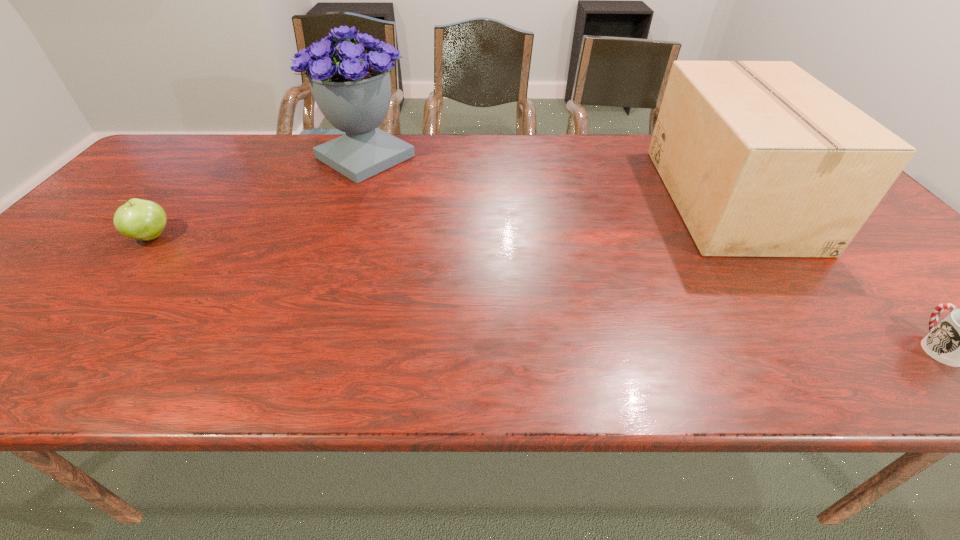
Identify the location of object that is at the left edge. Image resolution: width=960 pixels, height=540 pixels. (138, 219).

Where is `object that is at the right edge`? This screenshot has height=540, width=960. object that is at the right edge is located at coordinates (761, 159).

The image size is (960, 540). Find the location of `object positioned at the far right corner`. object positioned at the far right corner is located at coordinates (761, 159).

At what (x,y) coordinates should I click in order to perform the action: click on vacant space at the far edge. Please return your answer as a coordinate pair (x, y). Looking at the image, I should click on (608, 171).

Locate an element on the screen. Image resolution: width=960 pixels, height=540 pixels. vacant point at the near edge is located at coordinates (126, 363).

Locate an element on the screen. Image resolution: width=960 pixels, height=540 pixels. blank space at the left edge of the desktop is located at coordinates (46, 273).

Locate an element on the screen. Image resolution: width=960 pixels, height=540 pixels. free space at the near right corner of the desktop is located at coordinates (936, 361).

This screenshot has height=540, width=960. What are the coordinates of `blank region between the second object from left to right and the third shortest object` in the screenshot? It's located at (547, 178).

You are a GUI agent. You are given a task and a screenshot of the screen. Output one action in this format:
    pyautogui.click(x=<x>, y=<y>)
    Task: Click on the free spot between the tallest object and the apple
    The image size is (960, 540).
    Given the screenshot: What is the action you would take?
    pyautogui.click(x=258, y=197)

Where is `vacant area that lies between the second shortest object and the tallest object`? The height and width of the screenshot is (540, 960). vacant area that lies between the second shortest object and the tallest object is located at coordinates (258, 197).